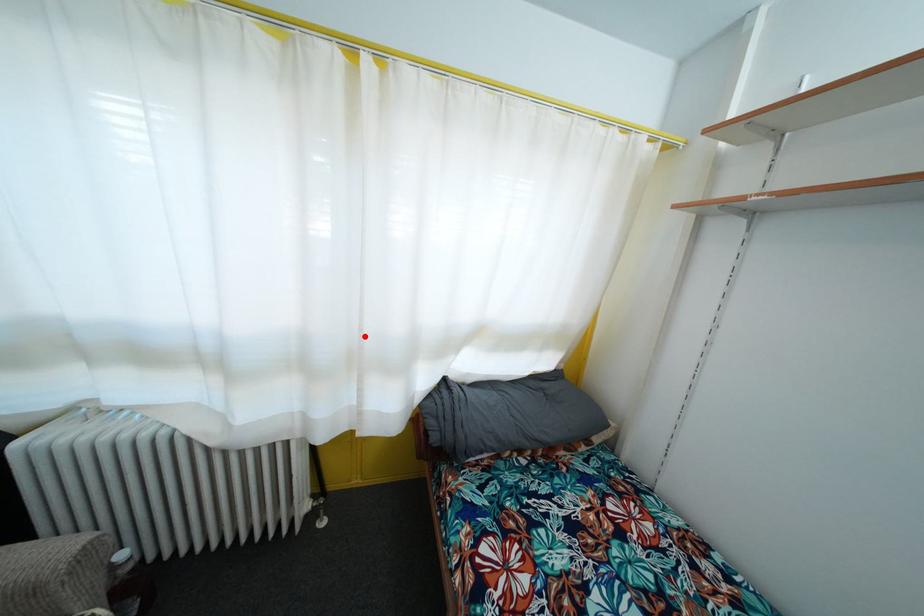
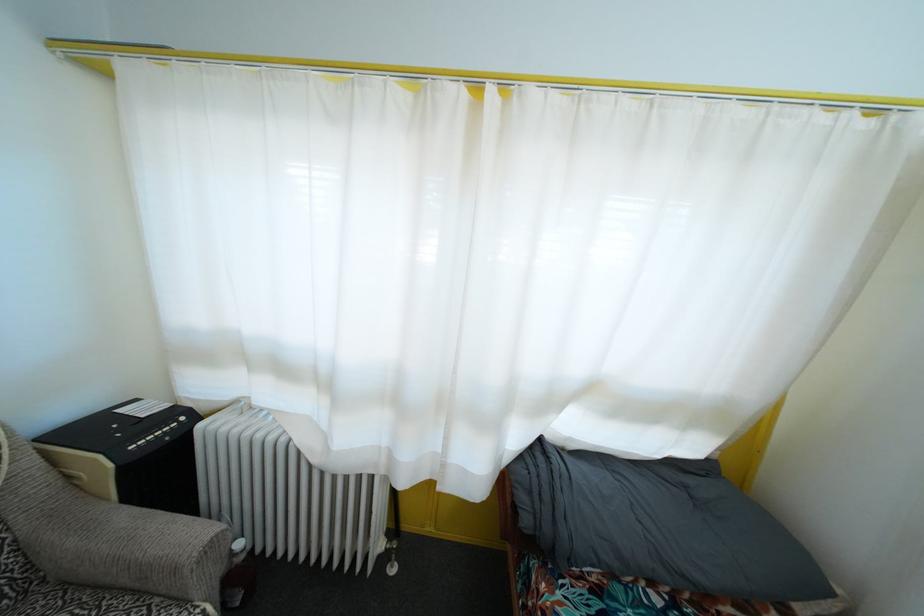
In the second image, find the point that corresponds to the highlighted location in the first image.

(457, 379)